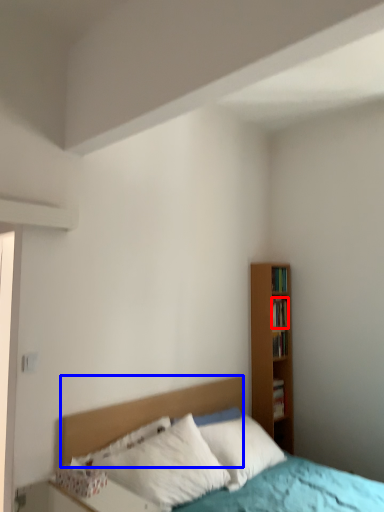
Question: Which object appears closest to the camera in this image, book (highlighted by a red box) or headboard (highlighted by a blue box)?

Choices:
 (A) book
 (B) headboard

Answer: (B)